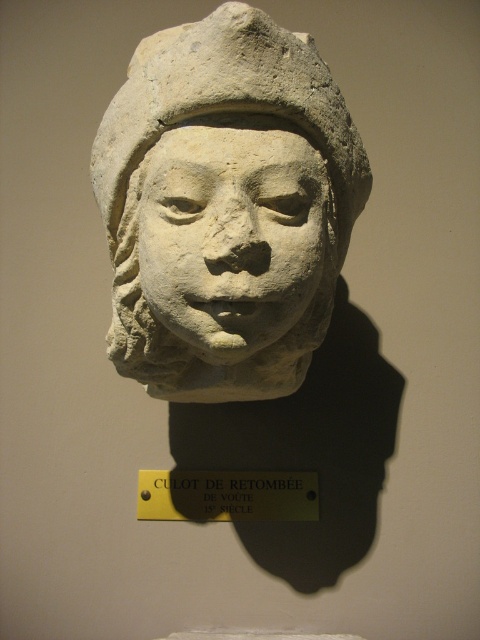
Consider the image. You are an art conservator assessing the space between two objects in the image. The white stone bust at center and the yellow metal sign at center are both mounted on the same wall. Which object is wider?

The white stone bust at center is wider than the yellow metal sign at center.

You are an art conservator examining the stone sculpture and its plaque. You need to clean both the stone face at center and the yellow metal sign at center. Which object should you clean first if you want to start from the top and work your way down?

The stone face at center is above the yellow metal sign at center, so you should clean the stone face at center first before moving down to the yellow metal sign at center.